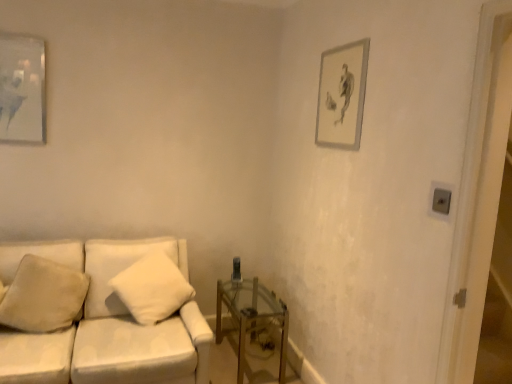
Question: Is matte gray picture frame at upper right, which ranks as the second picture frame in left-to-right order, touching white soft pillow at center, arranged as the 2th pillow when viewed from the left?

Choices:
 (A) yes
 (B) no

Answer: (B)

Question: From a real-world perspective, is matte gray picture frame at upper right, which ranks as the second picture frame in left-to-right order, under white soft pillow at center, arranged as the 2th pillow when viewed from the left?

Choices:
 (A) yes
 (B) no

Answer: (B)

Question: Can you confirm if matte gray picture frame at upper right, which ranks as the second picture frame in left-to-right order, is bigger than white soft pillow at center, arranged as the 2th pillow when viewed from the left?

Choices:
 (A) no
 (B) yes

Answer: (A)

Question: Is matte gray picture frame at upper right, the first picture frame viewed from the right, shorter than white soft pillow at center, acting as the first pillow starting from the right?

Choices:
 (A) no
 (B) yes

Answer: (A)

Question: From the image's perspective, does matte gray picture frame at upper right, which ranks as the second picture frame in left-to-right order, appear higher than white soft pillow at center, acting as the first pillow starting from the right?

Choices:
 (A) no
 (B) yes

Answer: (B)

Question: In terms of width, does matte gray picture frame at upper right, the first picture frame viewed from the right, look wider or thinner when compared to beige soft pillow at lower left, which ranks as the 2th pillow in right-to-left order?

Choices:
 (A) wide
 (B) thin

Answer: (B)

Question: Which is correct: matte gray picture frame at upper right, which ranks as the second picture frame in left-to-right order, is inside beige soft pillow at lower left, marked as the 1th pillow in a left-to-right arrangement, or outside of it?

Choices:
 (A) outside
 (B) inside

Answer: (A)

Question: Is matte gray picture frame at upper right, which ranks as the second picture frame in left-to-right order, taller or shorter than beige soft pillow at lower left, which ranks as the 2th pillow in right-to-left order?

Choices:
 (A) short
 (B) tall

Answer: (A)

Question: Based on their sizes in the image, would you say matte gray picture frame at upper right, which ranks as the second picture frame in left-to-right order, is bigger or smaller than beige soft pillow at lower left, which ranks as the 2th pillow in right-to-left order?

Choices:
 (A) small
 (B) big

Answer: (A)

Question: Looking at their shapes, would you say transparent glass table at lower right is wider or thinner than beige soft pillow at lower left, marked as the 1th pillow in a left-to-right arrangement?

Choices:
 (A) thin
 (B) wide

Answer: (B)

Question: From the image's perspective, relative to beige soft pillow at lower left, which ranks as the 2th pillow in right-to-left order, is transparent glass table at lower right above or below?

Choices:
 (A) above
 (B) below

Answer: (B)

Question: Considering the positions of transparent glass table at lower right and beige soft pillow at lower left, which ranks as the 2th pillow in right-to-left order, in the image, is transparent glass table at lower right taller or shorter than beige soft pillow at lower left, which ranks as the 2th pillow in right-to-left order,?

Choices:
 (A) short
 (B) tall

Answer: (A)

Question: Is point (226, 299) positioned closer to the camera than point (31, 284)?

Choices:
 (A) farther
 (B) closer

Answer: (A)

Question: From the image's perspective, is beige soft pillow at lower left, marked as the 1th pillow in a left-to-right arrangement, located above or below white soft pillow at center, acting as the first pillow starting from the right?

Choices:
 (A) below
 (B) above

Answer: (A)

Question: In terms of size, does beige soft pillow at lower left, which ranks as the 2th pillow in right-to-left order, appear bigger or smaller than white soft pillow at center, acting as the first pillow starting from the right?

Choices:
 (A) small
 (B) big

Answer: (A)